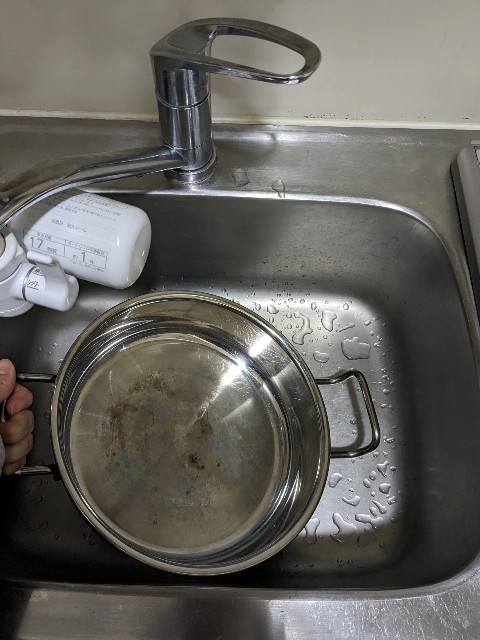
This screenshot has height=640, width=480. I want to click on faucet, so pyautogui.click(x=64, y=173).